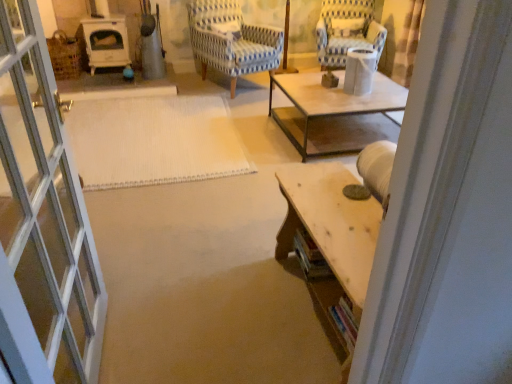
Image resolution: width=512 pixels, height=384 pixels. Identify the location of free space to the left of wooden table at lower right. (215, 302).